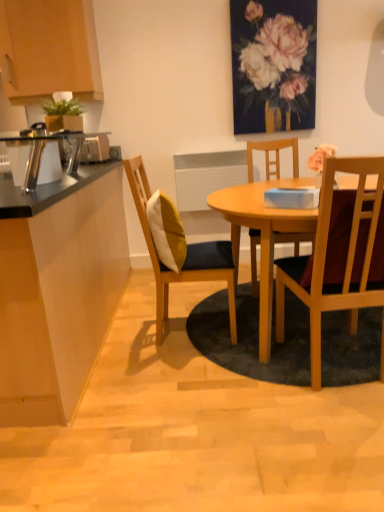
This screenshot has height=512, width=384. What are the coordinates of `vacant area that is in front of wooden chair with cushion at center, arranged as the second chair when viewed from the right` in the screenshot? It's located at (170, 376).